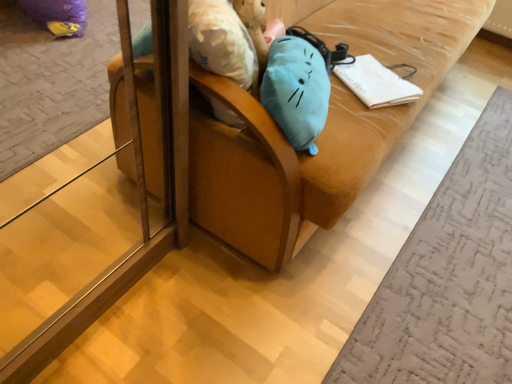
Question: Considering the relative sizes of velvet brown armchair at center and white paper at center in the image provided, is velvet brown armchair at center taller than white paper at center?

Choices:
 (A) yes
 (B) no

Answer: (A)

Question: Could you tell me if velvet brown armchair at center is turned towards white paper at center?

Choices:
 (A) no
 (B) yes

Answer: (B)

Question: From the image's perspective, does velvet brown armchair at center appear higher than white paper at center?

Choices:
 (A) yes
 (B) no

Answer: (A)

Question: Considering the relative sizes of velvet brown armchair at center and white paper at center in the image provided, is velvet brown armchair at center smaller than white paper at center?

Choices:
 (A) no
 (B) yes

Answer: (A)

Question: Is velvet brown armchair at center far away from white paper at center?

Choices:
 (A) yes
 (B) no

Answer: (B)

Question: Are velvet brown armchair at center and white paper at center beside each other?

Choices:
 (A) yes
 (B) no

Answer: (B)

Question: Is the depth of white paper at center greater than that of velvet brown armchair at center?

Choices:
 (A) no
 (B) yes

Answer: (B)

Question: Could velvet brown armchair at center be considered to be inside white paper at center?

Choices:
 (A) no
 (B) yes

Answer: (A)

Question: Is white paper at center to the right of velvet brown armchair at center from the viewer's perspective?

Choices:
 (A) no
 (B) yes

Answer: (B)

Question: Is white paper at center facing away from velvet brown armchair at center?

Choices:
 (A) no
 (B) yes

Answer: (B)

Question: From the image's perspective, is white paper at center below velvet brown armchair at center?

Choices:
 (A) yes
 (B) no

Answer: (A)

Question: Is white paper at center wider than velvet brown armchair at center?

Choices:
 (A) no
 (B) yes

Answer: (A)

Question: Considering their positions, is white paper at center located in front of or behind velvet brown armchair at center?

Choices:
 (A) behind
 (B) front

Answer: (A)